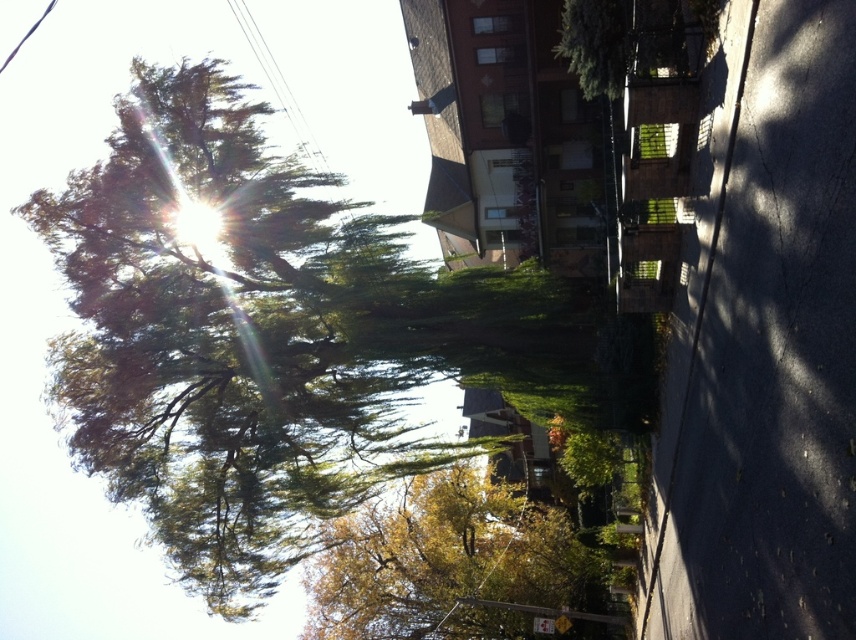
This screenshot has width=856, height=640. What do you see at coordinates (223, 333) in the screenshot?
I see `green leafy tree at upper left` at bounding box center [223, 333].

Between green leafy tree at upper left and dark asphalt road at center, which one appears on the right side from the viewer's perspective?

Positioned to the right is dark asphalt road at center.

Which is in front, point (140, 448) or point (749, 508)?

Point (749, 508) is in front.

Locate an element on the screen. The width and height of the screenshot is (856, 640). green leafy tree at upper left is located at coordinates (223, 333).

Is green leafy tree at upper left taller than yellow-green leaves at center?

Indeed, green leafy tree at upper left has a greater height compared to yellow-green leaves at center.

Where is `green leafy tree at upper left`? Image resolution: width=856 pixels, height=640 pixels. green leafy tree at upper left is located at coordinates (223, 333).

This screenshot has height=640, width=856. What are the coordinates of `dark asphalt road at center` in the screenshot? It's located at (762, 342).

Does point (658, 618) come closer to viewer compared to point (324, 572)?

That is True.

What do you see at coordinates (762, 342) in the screenshot?
I see `dark asphalt road at center` at bounding box center [762, 342].

Where is `dark asphalt road at center`? dark asphalt road at center is located at coordinates (762, 342).